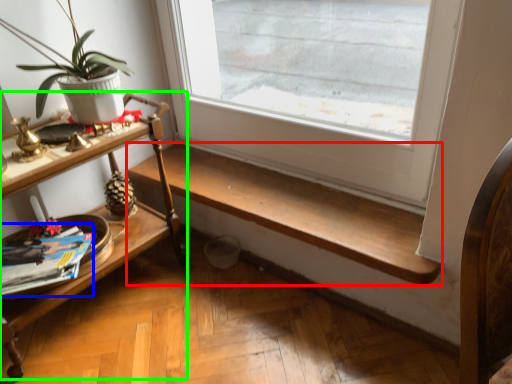
Question: Estimate the real-world distances between objects in this image. Which object is closer to stairwell (highlighted by a red box), magazine (highlighted by a blue box) or shelf (highlighted by a green box)?

Choices:
 (A) magazine
 (B) shelf

Answer: (B)